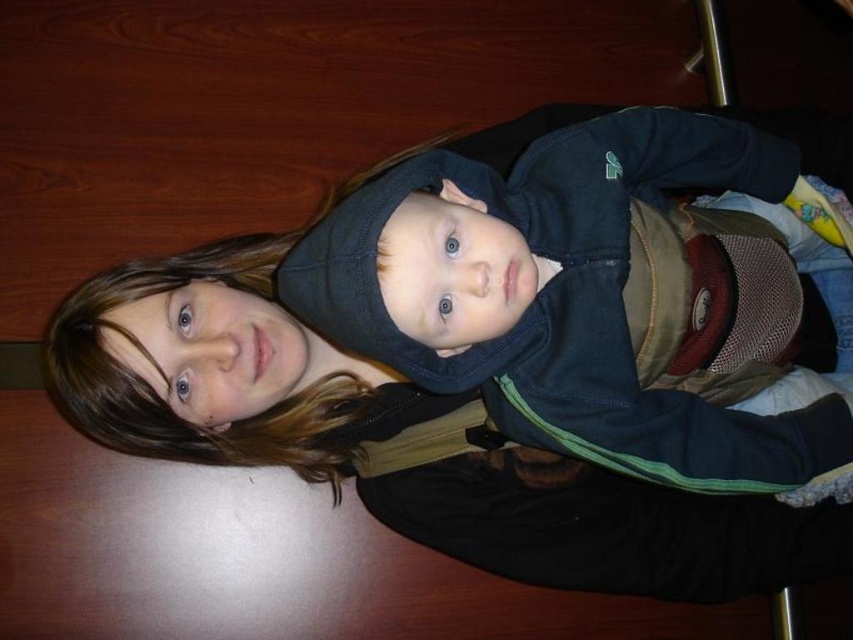
Does matte black jacket at center appear on the left side of dark blue fleece at center?

Correct, you'll find matte black jacket at center to the left of dark blue fleece at center.

Who is more distant from viewer, (x=566, y=477) or (x=722, y=429)?

The point (x=566, y=477) is behind.

Does point (155, 269) come behind point (730, 449)?

Yes, it is behind point (730, 449).

Image resolution: width=853 pixels, height=640 pixels. What are the coordinates of `matte black jacket at center` in the screenshot? It's located at (395, 440).